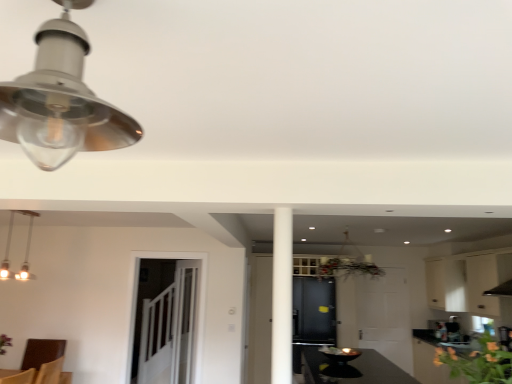
Question: Is the depth of white matte cabinet at upper right, which appears as the second cabinetry when viewed from the left, less than that of matte silver lampshade at upper left, the 2th lamp positioned from the left?

Choices:
 (A) yes
 (B) no

Answer: (B)

Question: Does white matte cabinet at upper right, the first cabinetry when ordered from right to left, come behind matte silver lampshade at upper left, which ranks as the 2th lamp in bottom-to-top order?

Choices:
 (A) no
 (B) yes

Answer: (B)

Question: Is white matte cabinet at upper right, the first cabinetry when ordered from right to left, bigger than matte silver lampshade at upper left, which ranks as the 2th lamp in bottom-to-top order?

Choices:
 (A) yes
 (B) no

Answer: (A)

Question: Considering the relative positions of white matte cabinet at upper right, the first cabinetry when ordered from right to left, and matte silver lampshade at upper left, the 2th lamp positioned from the left, in the image provided, is white matte cabinet at upper right, the first cabinetry when ordered from right to left, to the right of matte silver lampshade at upper left, the 2th lamp positioned from the left, from the viewer's perspective?

Choices:
 (A) no
 (B) yes

Answer: (B)

Question: Is white matte cabinet at upper right, the first cabinetry when ordered from right to left, outside of matte silver lampshade at upper left, which ranks as the 2th lamp in bottom-to-top order?

Choices:
 (A) yes
 (B) no

Answer: (A)

Question: Does white matte cabinet at upper right, the first cabinetry when ordered from right to left, turn towards matte silver lampshade at upper left, the 2th lamp positioned from the left?

Choices:
 (A) yes
 (B) no

Answer: (B)

Question: Is green leafy plant at lower right at the right side of clear glass door at center?

Choices:
 (A) yes
 (B) no

Answer: (A)

Question: Does green leafy plant at lower right touch clear glass door at center?

Choices:
 (A) no
 (B) yes

Answer: (A)

Question: From a real-world perspective, is green leafy plant at lower right on top of clear glass door at center?

Choices:
 (A) no
 (B) yes

Answer: (B)

Question: Can you confirm if green leafy plant at lower right is smaller than clear glass door at center?

Choices:
 (A) no
 (B) yes

Answer: (B)

Question: Would you say clear glass door at center is part of green leafy plant at lower right's contents?

Choices:
 (A) no
 (B) yes

Answer: (A)

Question: Considering the relative sizes of green leafy plant at lower right and clear glass door at center in the image provided, is green leafy plant at lower right thinner than clear glass door at center?

Choices:
 (A) no
 (B) yes

Answer: (A)

Question: Is clear glass door at center not inside white matte cabinet at upper right, the first cabinetry when ordered from right to left?

Choices:
 (A) no
 (B) yes

Answer: (B)